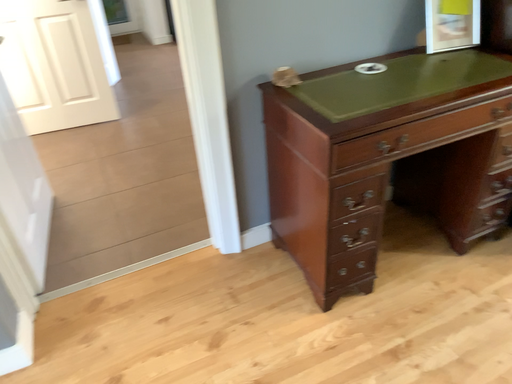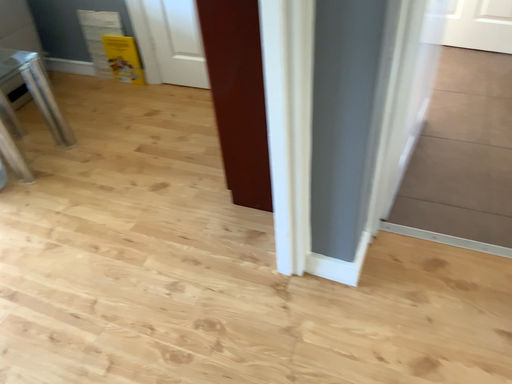
Question: How did the camera likely rotate when shooting the video?

Choices:
 (A) rotated left
 (B) rotated right

Answer: (A)